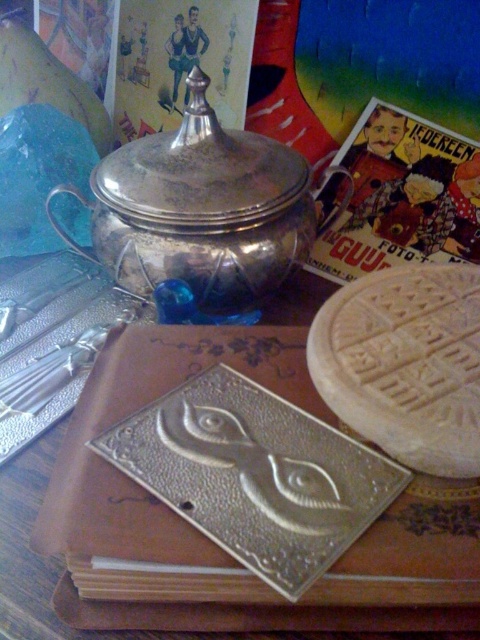
Is point (130, 224) positioned behind point (472, 227)?

No, it is not.

The width and height of the screenshot is (480, 640). I want to click on shiny silver teapot at upper center, so click(x=203, y=209).